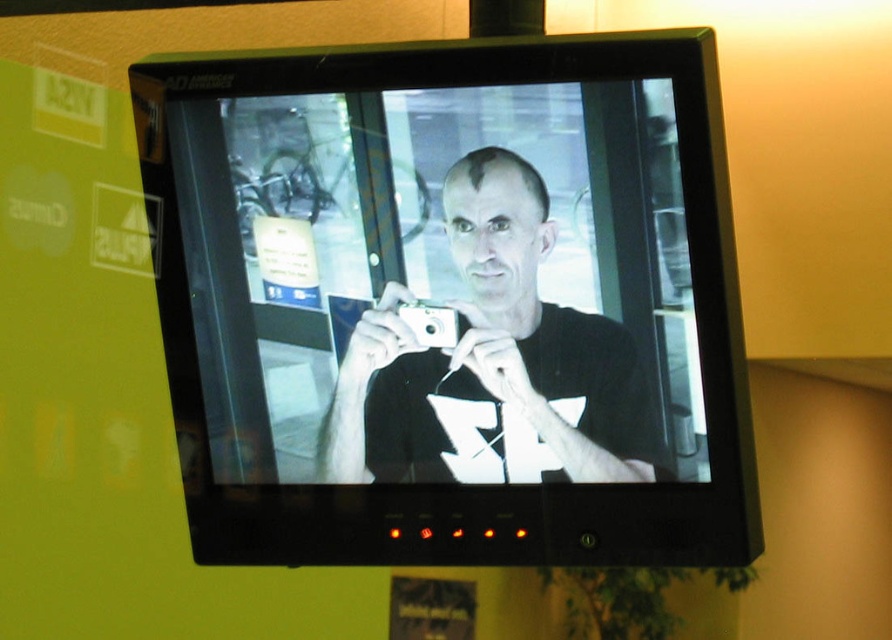
Question: Which point appears closest to the camera in this image?

Choices:
 (A) (420, 444)
 (B) (377, 310)

Answer: (B)

Question: Is black glossy monitor at center to the left of white glossy camera at center from the viewer's perspective?

Choices:
 (A) no
 (B) yes

Answer: (B)

Question: Does black glossy monitor at center appear on the right side of white glossy camera at center?

Choices:
 (A) yes
 (B) no

Answer: (B)

Question: Does black glossy monitor at center lie in front of white glossy camera at center?

Choices:
 (A) yes
 (B) no

Answer: (A)

Question: Which object appears farthest from the camera in this image?

Choices:
 (A) white glossy camera at center
 (B) black glossy monitor at center

Answer: (A)